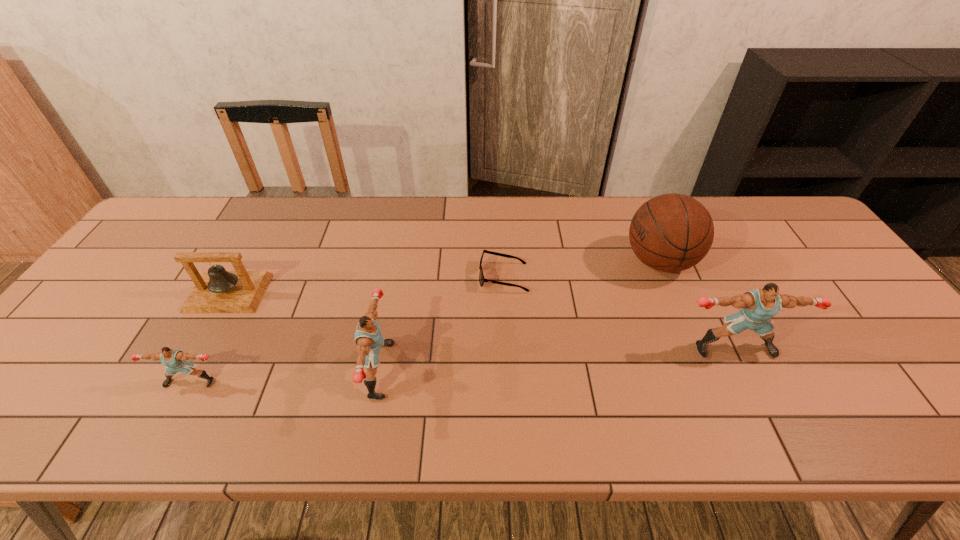
Locate an element on the screen. The height and width of the screenshot is (540, 960). vacant area at the right edge is located at coordinates pyautogui.click(x=861, y=323).

In the image, there is a desktop. What are the coordinates of `vacant region at the far left corner` in the screenshot? It's located at (198, 233).

Locate an element on the screen. The height and width of the screenshot is (540, 960). vacant space at the far right corner of the desktop is located at coordinates (793, 220).

Where is `unoccupied area between the bell and the fourth object from right to left`? This screenshot has width=960, height=540. unoccupied area between the bell and the fourth object from right to left is located at coordinates (303, 332).

At what (x,y) coordinates should I click in order to perform the action: click on vacant space that's between the bell and the rightmost puncher. Please return your answer as a coordinate pair (x, y). Looking at the image, I should click on (481, 321).

Identify the location of vacant point located between the bell and the shortest puncher. [x=209, y=337].

Where is `vacant space in between the rightmost puncher and the bell`? This screenshot has height=540, width=960. vacant space in between the rightmost puncher and the bell is located at coordinates (481, 321).

This screenshot has width=960, height=540. Find the location of `empty location between the rightmost puncher and the basketball`. empty location between the rightmost puncher and the basketball is located at coordinates (696, 305).

Locate an element on the screen. vacant space that's between the second puncher from left to right and the basketball is located at coordinates (519, 316).

Find the location of `free space that is in between the bell and the basketball`. free space that is in between the bell and the basketball is located at coordinates (444, 277).